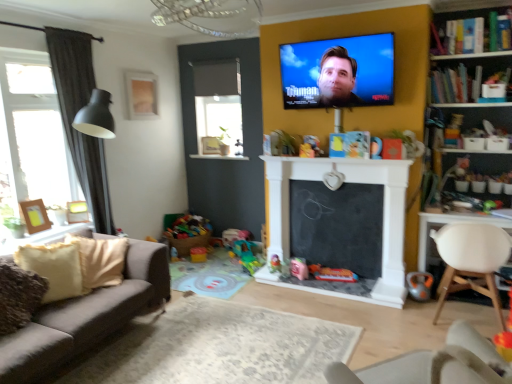
Question: Considering the relative sizes of white plastic chair at lower right, which is counted as the 2th chair, starting from the back, and plush yellow toy at center, which is counted as the 3th toy, starting from the right, in the image provided, is white plastic chair at lower right, which is counted as the 2th chair, starting from the back, taller than plush yellow toy at center, which is counted as the 3th toy, starting from the right,?

Choices:
 (A) no
 (B) yes

Answer: (B)

Question: Is white plastic chair at lower right, which is the first chair in front-to-back order, shorter than plush yellow toy at center, the 7th toy positioned from the bottom?

Choices:
 (A) yes
 (B) no

Answer: (B)

Question: Is white plastic chair at lower right, which is the first chair in front-to-back order, not within plush yellow toy at center, the second toy in the front-to-back sequence?

Choices:
 (A) yes
 (B) no

Answer: (A)

Question: Does white plastic chair at lower right, which is the first chair in front-to-back order, appear on the right side of plush yellow toy at center, the second toy in the front-to-back sequence?

Choices:
 (A) no
 (B) yes

Answer: (B)

Question: From a real-world perspective, is white plastic chair at lower right, marked as the second chair in a right-to-left arrangement, physically below plush yellow toy at center, which is counted as the 3th toy, starting from the right?

Choices:
 (A) no
 (B) yes

Answer: (B)

Question: Is plastic green toy at center, placed as the third toy when sorted from bottom to top, taller or shorter than rubberized plastic toy at center, marked as the third toy in a top-to-bottom arrangement?

Choices:
 (A) short
 (B) tall

Answer: (A)

Question: Is point (248, 261) closer or farther from the camera than point (175, 256)?

Choices:
 (A) closer
 (B) farther

Answer: (A)

Question: Considering the positions of plastic green toy at center, the third toy viewed from the left, and rubberized plastic toy at center, positioned as the fifth toy in bottom-to-top order, in the image, is plastic green toy at center, the third toy viewed from the left, bigger or smaller than rubberized plastic toy at center, positioned as the fifth toy in bottom-to-top order,?

Choices:
 (A) small
 (B) big

Answer: (B)

Question: From a real-world perspective, is plastic green toy at center, positioned as the 5th toy in right-to-left order, physically located above or below rubberized plastic toy at center, which is the seventh toy in right-to-left order?

Choices:
 (A) above
 (B) below

Answer: (B)

Question: Looking at their shapes, would you say beige carpet at center is wider or thinner than bright multicolored plastic toys at lower left, marked as the 6th toy in a front-to-back arrangement?

Choices:
 (A) thin
 (B) wide

Answer: (B)

Question: Is beige carpet at center in front of or behind bright multicolored plastic toys at lower left, marked as the 6th toy in a front-to-back arrangement, in the image?

Choices:
 (A) behind
 (B) front

Answer: (B)

Question: Which is correct: beige carpet at center is inside bright multicolored plastic toys at lower left, acting as the sixth toy starting from the bottom, or outside of it?

Choices:
 (A) outside
 (B) inside

Answer: (A)

Question: Is beige carpet at center bigger or smaller than bright multicolored plastic toys at lower left, which is counted as the 6th toy, starting from the right?

Choices:
 (A) small
 (B) big

Answer: (A)

Question: Is matte gold picture frame at upper left, which is counted as the first picture frame, starting from the back, bigger or smaller than wooden photo frame at left, acting as the third picture frame starting from the top?

Choices:
 (A) big
 (B) small

Answer: (A)

Question: From the image's perspective, is matte gold picture frame at upper left, which is the 1th picture frame in right-to-left order, located above or below wooden photo frame at left, acting as the third picture frame starting from the top?

Choices:
 (A) above
 (B) below

Answer: (A)